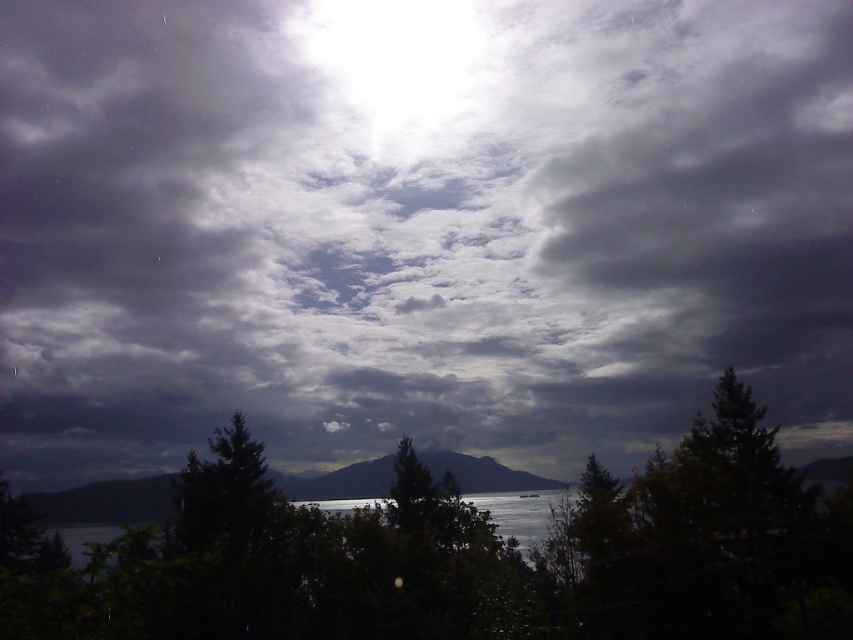
Question: Is green leafy tree at center thinner than dark gray rocky mountain at center?

Choices:
 (A) no
 (B) yes

Answer: (B)

Question: Which point is farther to the camera?

Choices:
 (A) (389, 464)
 (B) (698, 449)

Answer: (A)

Question: Does green leafy tree at center appear over dark gray rocky mountain at center?

Choices:
 (A) yes
 (B) no

Answer: (A)

Question: Is green leafy tree at center bigger than dark gray rocky mountain at center?

Choices:
 (A) yes
 (B) no

Answer: (B)